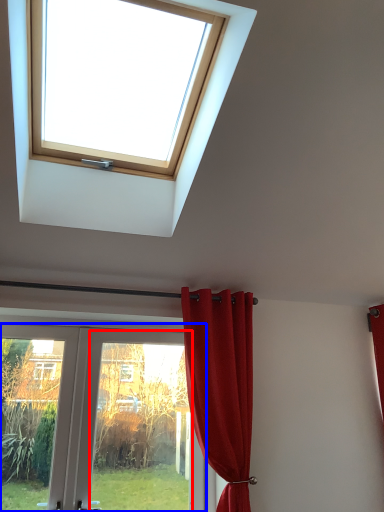
Question: Among these objects, which one is farthest to the camera, glass door (highlighted by a red box) or door (highlighted by a blue box)?

Choices:
 (A) glass door
 (B) door

Answer: (A)